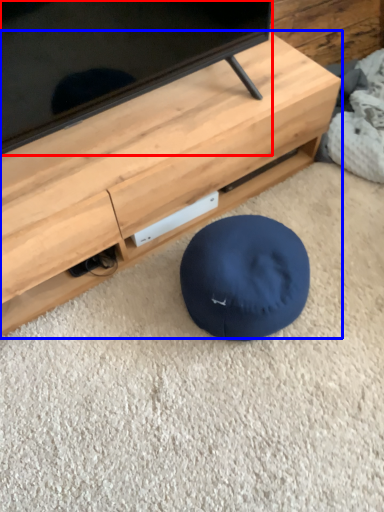
Question: Among these objects, which one is farthest to the camera, television (highlighted by a red box) or furniture (highlighted by a blue box)?

Choices:
 (A) television
 (B) furniture

Answer: (B)